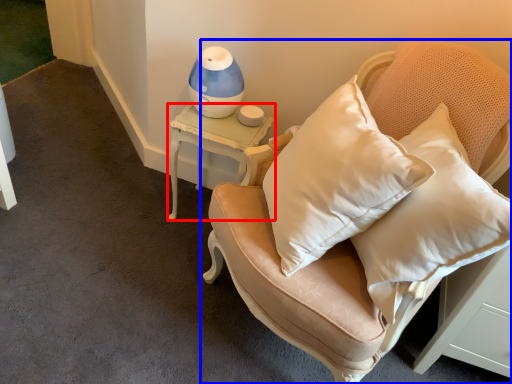
Question: Which of the following is the closest to the observer, table (highlighted by a red box) or furniture (highlighted by a blue box)?

Choices:
 (A) table
 (B) furniture

Answer: (B)